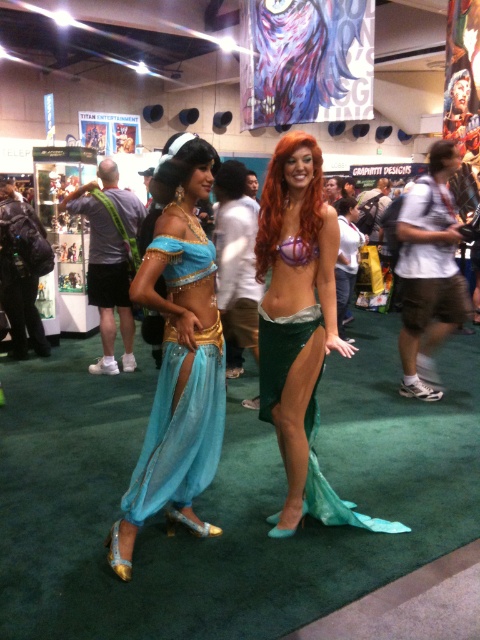
Does matte blue fabric dress at center have a greater height compared to shiny green tail at center?

Correct, matte blue fabric dress at center is much taller as shiny green tail at center.

Between point (204, 252) and point (278, 182), which one is positioned in front?

Point (204, 252) is in front.

Between point (180, 300) and point (274, 291), which one is positioned behind?

The point (274, 291) is behind.

Locate an element on the screen. This screenshot has width=480, height=640. matte blue fabric dress at center is located at coordinates (178, 355).